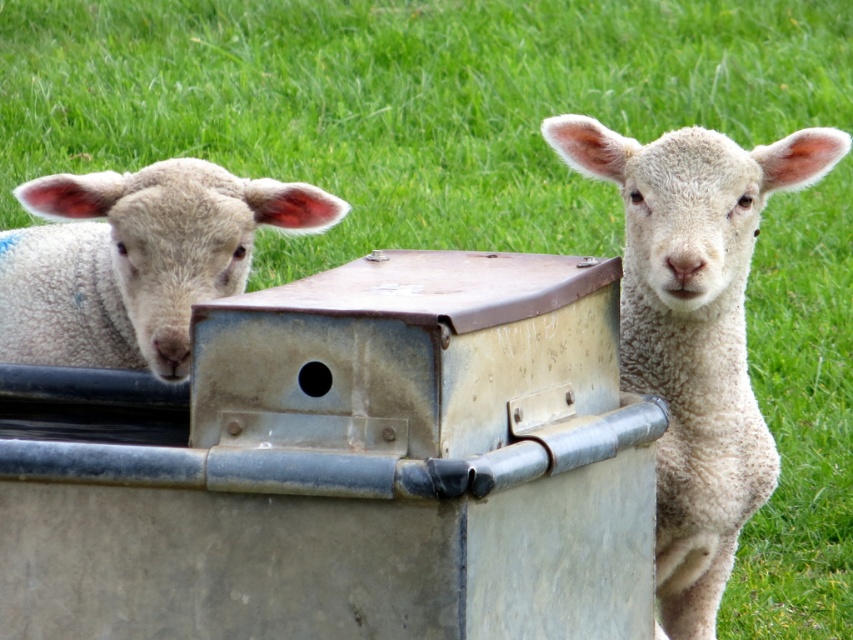
You are a farmer who needs to separate two lambs using a divider that is 60 centimeters wide. The divider can only be placed between the white woolen lamb at center and the white woolen lamb at left. Based on the image, will the divider fit between them?

The distance between the white woolen lamb at center and the white woolen lamb at left is 57.97 centimeters. Since the divider is 60 centimeters wide, which is wider than the space between them, it will not fit. You need a divider that is narrower than 57.97 centimeters.